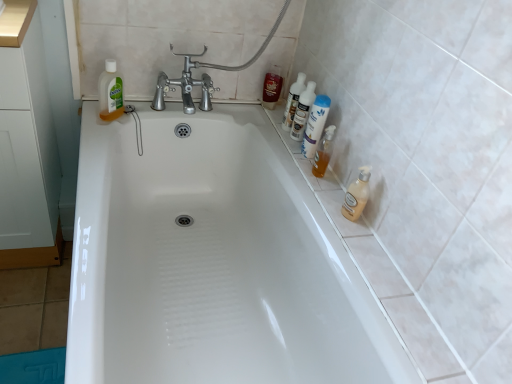
Question: Is translucent plastic bottle at upper left, acting as the 4th cleaning product starting from the right, to the left of translucent plastic bottles at upper right, marked as the 3th cleaning product in a right-to-left arrangement, from the viewer's perspective?

Choices:
 (A) yes
 (B) no

Answer: (A)

Question: Considering the relative sizes of translucent plastic bottle at upper left, the first cleaning product when ordered from left to right, and translucent plastic bottles at upper right, marked as the 3th cleaning product in a right-to-left arrangement, in the image provided, is translucent plastic bottle at upper left, the first cleaning product when ordered from left to right, thinner than translucent plastic bottles at upper right, marked as the 3th cleaning product in a right-to-left arrangement,?

Choices:
 (A) yes
 (B) no

Answer: (A)

Question: From a real-world perspective, is translucent plastic bottle at upper left, the first cleaning product when ordered from left to right, under translucent plastic bottles at upper right, marked as the 3th cleaning product in a right-to-left arrangement?

Choices:
 (A) yes
 (B) no

Answer: (A)

Question: Considering the relative sizes of translucent plastic bottle at upper left, acting as the 4th cleaning product starting from the right, and translucent plastic bottles at upper right, the 2th cleaning product positioned from the left, in the image provided, is translucent plastic bottle at upper left, acting as the 4th cleaning product starting from the right, smaller than translucent plastic bottles at upper right, the 2th cleaning product positioned from the left,?

Choices:
 (A) no
 (B) yes

Answer: (B)

Question: Does translucent plastic bottle at upper left, the first cleaning product when ordered from left to right, come behind translucent plastic bottles at upper right, the 2th cleaning product positioned from the left?

Choices:
 (A) no
 (B) yes

Answer: (A)

Question: Is translucent plastic bottles at upper right, the 2th cleaning product positioned from the left, located within translucent plastic bottle at upper left, acting as the 4th cleaning product starting from the right?

Choices:
 (A) yes
 (B) no

Answer: (B)

Question: From the image's perspective, does translucent plastic bottles at upper right, the 2th cleaning product positioned from the left, appear higher than white glossy bathtub at center?

Choices:
 (A) no
 (B) yes

Answer: (B)

Question: Is translucent plastic bottles at upper right, marked as the 3th cleaning product in a right-to-left arrangement, surrounding white glossy bathtub at center?

Choices:
 (A) yes
 (B) no

Answer: (B)

Question: Can you confirm if translucent plastic bottles at upper right, the 2th cleaning product positioned from the left, is bigger than white glossy bathtub at center?

Choices:
 (A) yes
 (B) no

Answer: (B)

Question: Are translucent plastic bottles at upper right, the 2th cleaning product positioned from the left, and white glossy bathtub at center far apart?

Choices:
 (A) yes
 (B) no

Answer: (B)

Question: From a real-world perspective, is translucent plastic bottles at upper right, marked as the 3th cleaning product in a right-to-left arrangement, on top of white glossy bathtub at center?

Choices:
 (A) yes
 (B) no

Answer: (A)

Question: Considering the relative sizes of translucent plastic bottles at upper right, the 2th cleaning product positioned from the left, and white glossy bathtub at center in the image provided, is translucent plastic bottles at upper right, the 2th cleaning product positioned from the left, taller than white glossy bathtub at center?

Choices:
 (A) yes
 (B) no

Answer: (B)

Question: Can you confirm if translucent plastic bottles at upper right, the 2th cleaning product positioned from the left, is shorter than white glossy bottles at upper right, which is counted as the second toiletry, starting from the back?

Choices:
 (A) yes
 (B) no

Answer: (A)